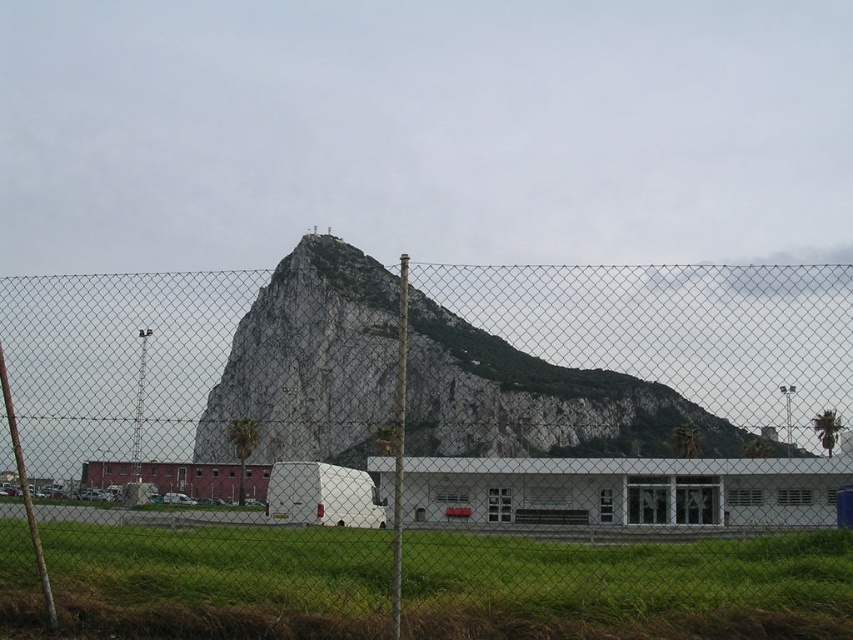
Is metal chain-link fence at center closer to camera compared to green grass at lower center?

No, metal chain-link fence at center is behind green grass at lower center.

Does metal chain-link fence at center appear over green grass at lower center?

Indeed, metal chain-link fence at center is positioned over green grass at lower center.

Is point (4, 310) farther from camera compared to point (229, 634)?

Yes.

Identify the location of metal chain-link fence at center. Image resolution: width=853 pixels, height=640 pixels. (426, 452).

Does point (572, 445) lie in front of point (410, 333)?

Yes, point (572, 445) is closer to viewer.

Find the location of `metal chain-link fence at center`. metal chain-link fence at center is located at coordinates (426, 452).

Is green grass at lower center taller than rocky gray mountain at center?

In fact, green grass at lower center may be shorter than rocky gray mountain at center.

Who is more forward, [231,621] or [393,394]?

Point [231,621] is more forward.

Which is behind, point (834, 547) or point (277, 278)?

The point (277, 278) is behind.

You are a GUI agent. You are given a task and a screenshot of the screen. Output one action in this format:
    pyautogui.click(x=<x>, y=<y>)
    Task: Click on the green grass at lower center
    The width and height of the screenshot is (853, 640).
    Given the screenshot: What is the action you would take?
    pyautogui.click(x=627, y=588)